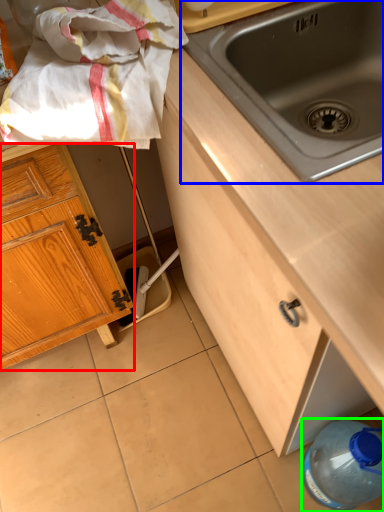
Question: Estimate the real-world distances between objects in this image. Which object is farther from cabinetry (highlighted by a red box), sink (highlighted by a blue box) or bottle (highlighted by a green box)?

Choices:
 (A) sink
 (B) bottle

Answer: (B)